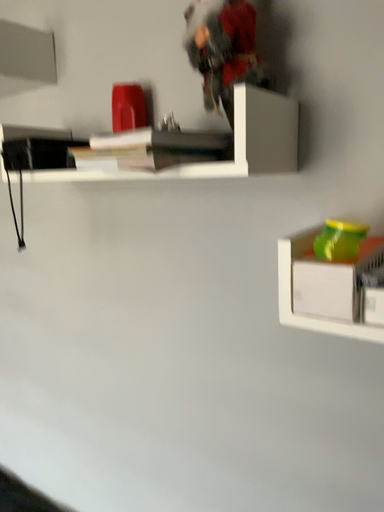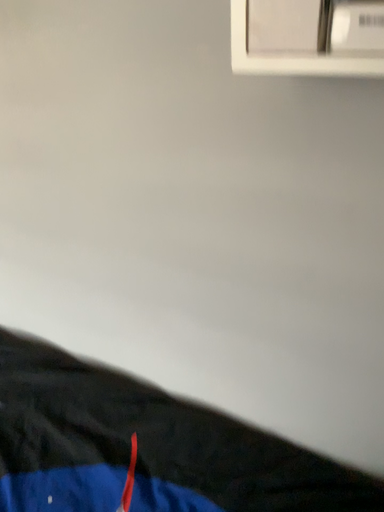
Question: Which way did the camera rotate in the video?

Choices:
 (A) rotated upward
 (B) rotated downward

Answer: (B)